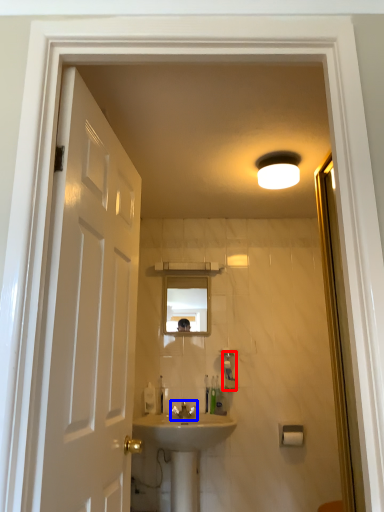
Question: Which point is closer to the camera, soap dispenser (highlighted by a red box) or tap (highlighted by a blue box)?

Choices:
 (A) soap dispenser
 (B) tap

Answer: (B)